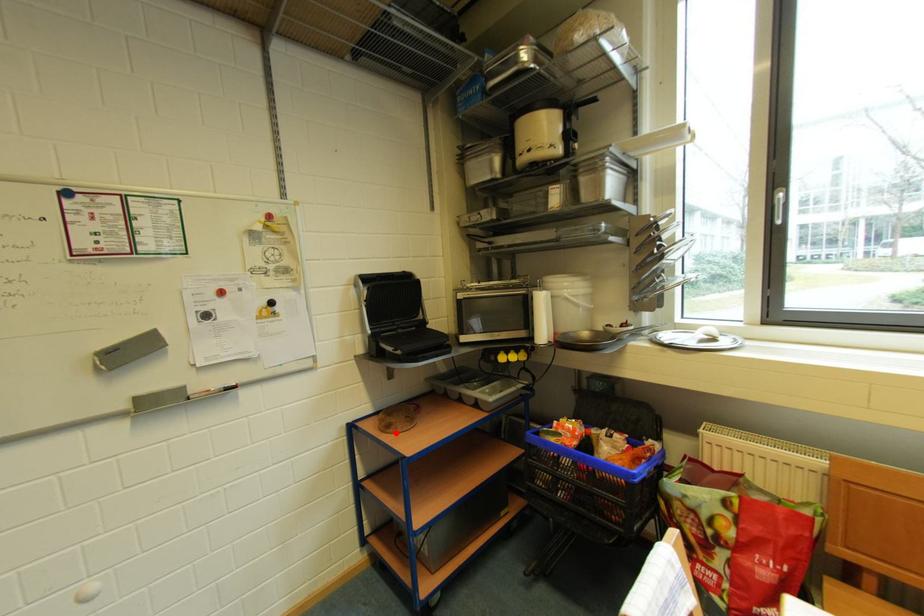
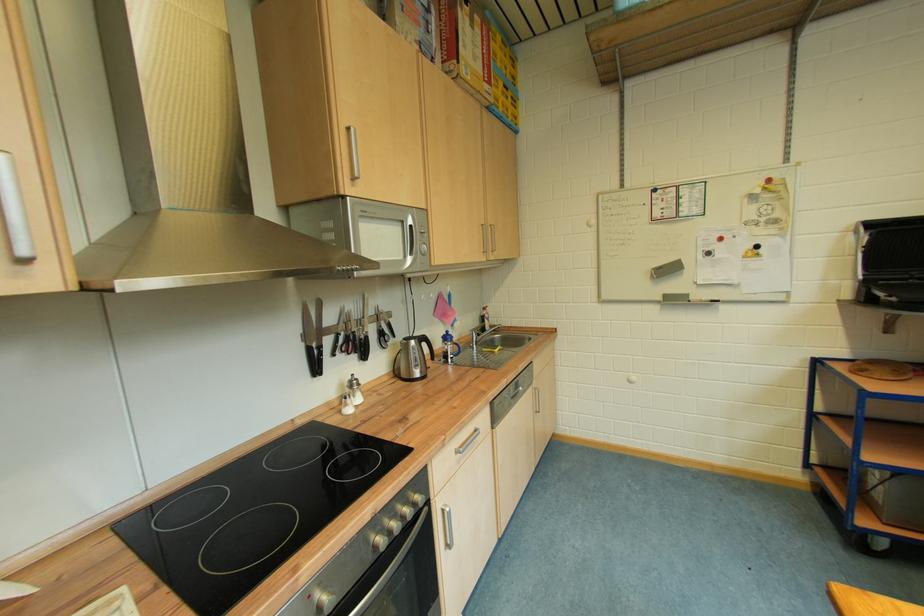
The point at the highlighted location is marked in the first image. Where is the corresponding point in the second image?

(868, 377)